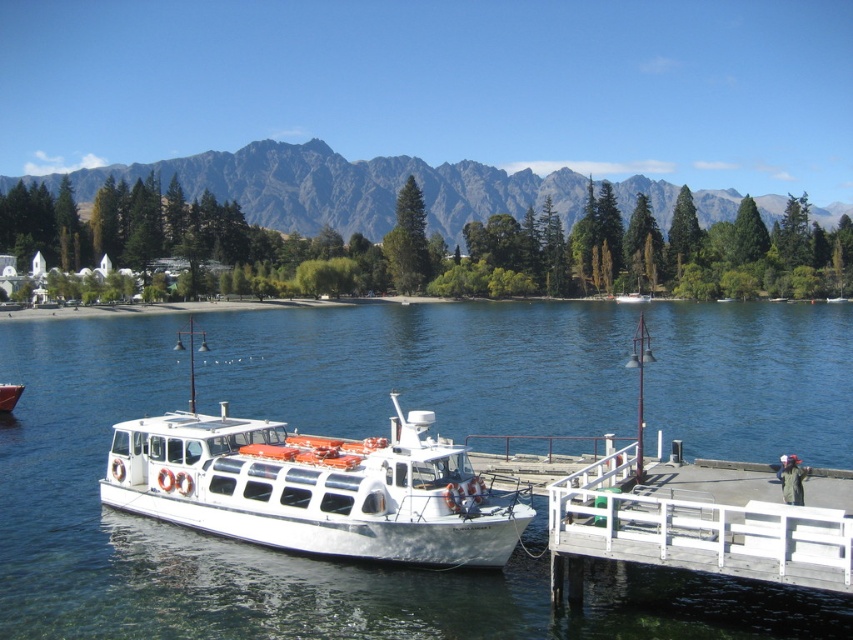
Looking at this image, you are planning to take a photo of the gray rocky mountain at upper center and the white wooden dock at lower right from the lakeside. Which object will appear taller in the photo?

The gray rocky mountain at upper center will appear taller in the photo because it has a greater height compared to the white wooden dock at lower right.

You are a tour guide planning a boat tour. The boat is docked at the wooden pier, and you need to ensure there is enough space between the boat and the gray rocky mountain at upper center for safe navigation. Can the boat safely navigate the space between them?

The boat can safely navigate the space between the boat and the gray rocky mountain at upper center because they are 160.04 meters apart, which is sufficient for safe passage.